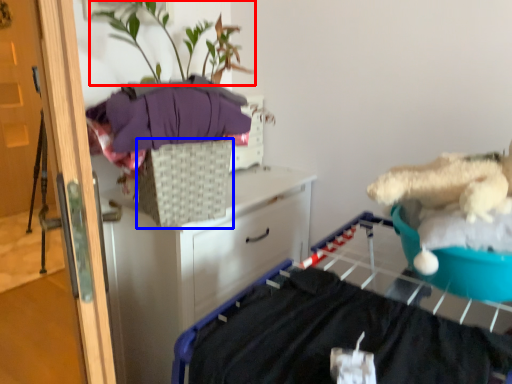
Question: Which point is further to the camera, plant (highlighted by a red box) or basket (highlighted by a blue box)?

Choices:
 (A) plant
 (B) basket

Answer: (B)